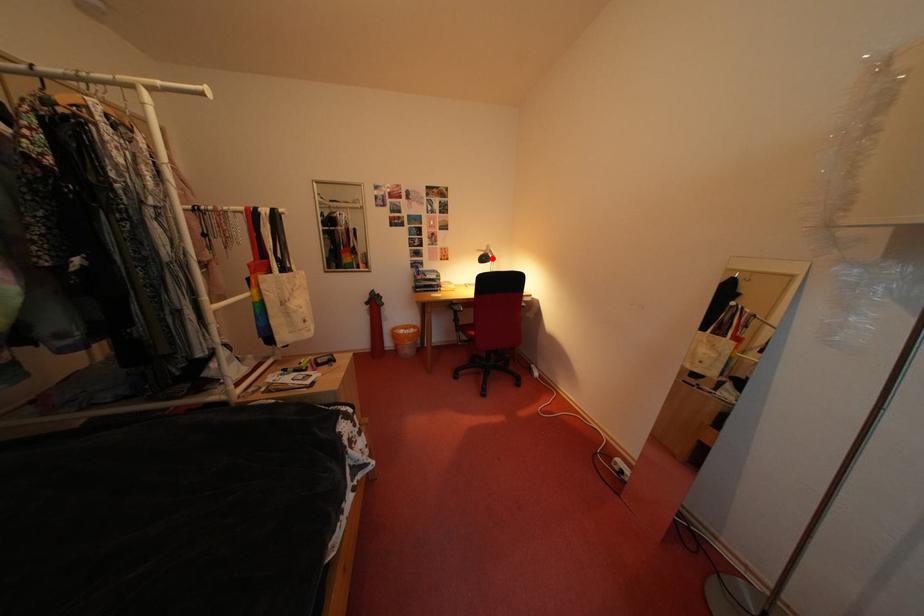
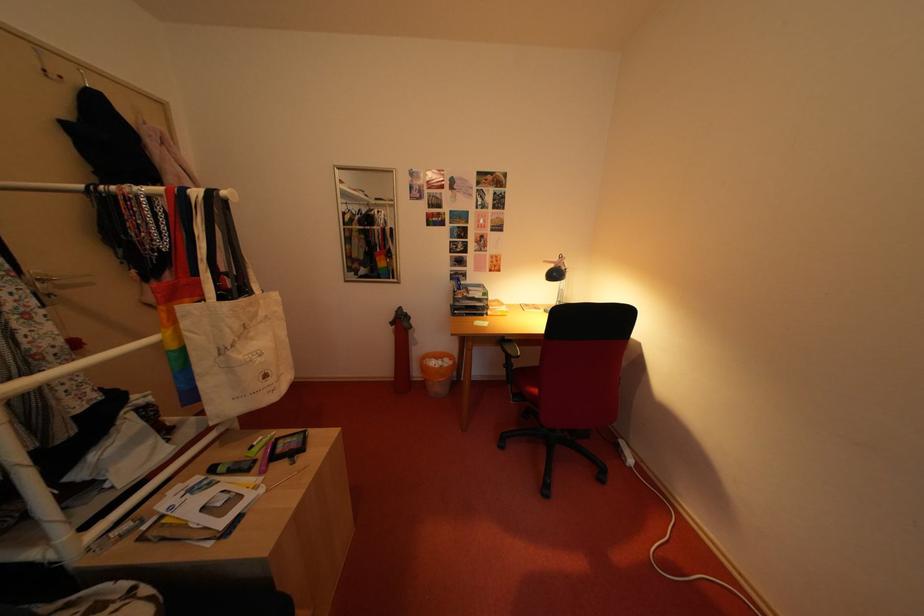
Question: I am providing you with two images of the same scene from different viewpoints. A red point is marked on the first image. At the location where the point appears in image 1, is it still visible in image 2?

Choices:
 (A) Yes
 (B) No

Answer: (A)